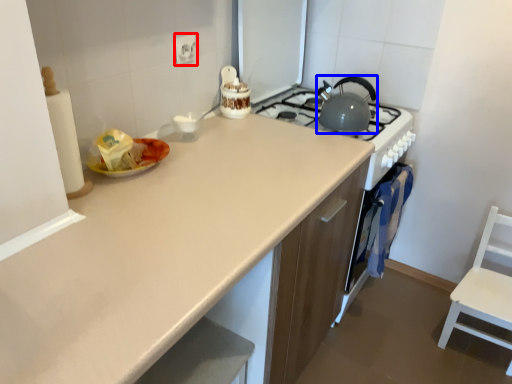
Question: Which object is closer to the camera taking this photo, electric outlet (highlighted by a red box) or kitchen appliance (highlighted by a blue box)?

Choices:
 (A) electric outlet
 (B) kitchen appliance

Answer: (A)